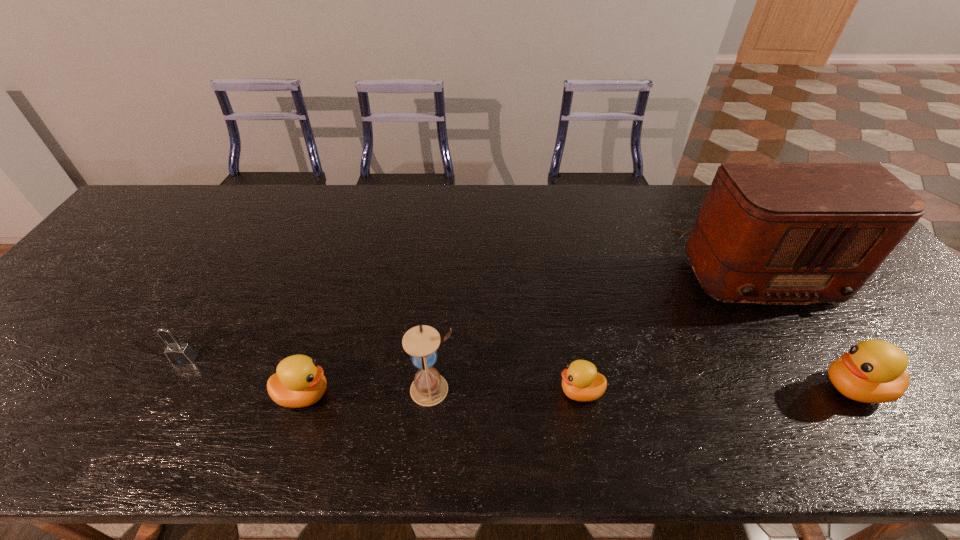
The height and width of the screenshot is (540, 960). In order to click on the fifth object from right to left in this screenshot , I will do coord(298,382).

At what (x,y) coordinates should I click in order to perform the action: click on the second shortest duckling. Please return your answer as a coordinate pair (x, y). Image resolution: width=960 pixels, height=540 pixels. Looking at the image, I should click on (298, 382).

Where is `the second duckling from right to left`? the second duckling from right to left is located at coordinates (581, 382).

Image resolution: width=960 pixels, height=540 pixels. What are the coordinates of `the shortest duckling` in the screenshot? It's located at (581, 382).

The image size is (960, 540). Identify the location of the third tallest object. (873, 371).

Where is `the rightmost duckling`? The height and width of the screenshot is (540, 960). the rightmost duckling is located at coordinates (873, 371).

Locate an element on the screen. The image size is (960, 540). the leftmost object is located at coordinates (178, 353).

Where is `the fifth nearest object`? Image resolution: width=960 pixels, height=540 pixels. the fifth nearest object is located at coordinates (178, 353).

Locate an element on the screen. Image resolution: width=960 pixels, height=540 pixels. the tallest object is located at coordinates (768, 233).

You are a GUI agent. You are given a task and a screenshot of the screen. Output one action in this format:
    pyautogui.click(x=<x>, y=<y>)
    Task: Click on the radio receiver
    The width and height of the screenshot is (960, 540).
    Given the screenshot: What is the action you would take?
    pyautogui.click(x=768, y=233)